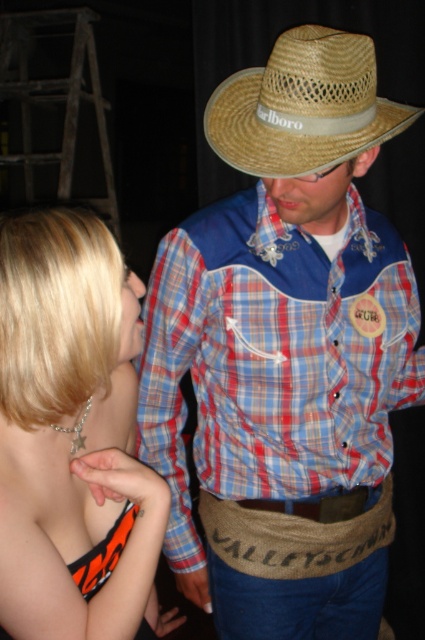
Is matte straw cowboy hat at center to the left of shiny silver necklace at upper left from the viewer's perspective?

No, matte straw cowboy hat at center is not to the left of shiny silver necklace at upper left.

Which is more to the right, matte straw cowboy hat at center or shiny silver necklace at upper left?

Positioned to the right is matte straw cowboy hat at center.

Which is behind, point (390, 236) or point (44, 401)?

Positioned behind is point (390, 236).

Where is `matte straw cowboy hat at center`? matte straw cowboy hat at center is located at coordinates (285, 332).

Can you confirm if shiny silver necklace at upper left is positioned to the right of strawmaterial/texturecowboy hat at upper center?

No, shiny silver necklace at upper left is not to the right of strawmaterial/texturecowboy hat at upper center.

Which is in front, point (2, 524) or point (291, 102)?

Point (2, 524) is more forward.

Locate an element on the screen. shiny silver necklace at upper left is located at coordinates (73, 436).

Who is lower down, matte straw cowboy hat at center or strawmaterial/texturecowboy hat at upper center?

matte straw cowboy hat at center is lower down.

Is point (167, 296) farther from camera compared to point (336, 145)?

Yes, point (167, 296) is behind point (336, 145).

Is point (325, 365) closer to viewer compared to point (271, 157)?

No, (325, 365) is behind (271, 157).

At what (x,y) coordinates should I click in order to perform the action: click on matte straw cowboy hat at center. Please return your answer as a coordinate pair (x, y). The width and height of the screenshot is (425, 640). Looking at the image, I should click on (285, 332).